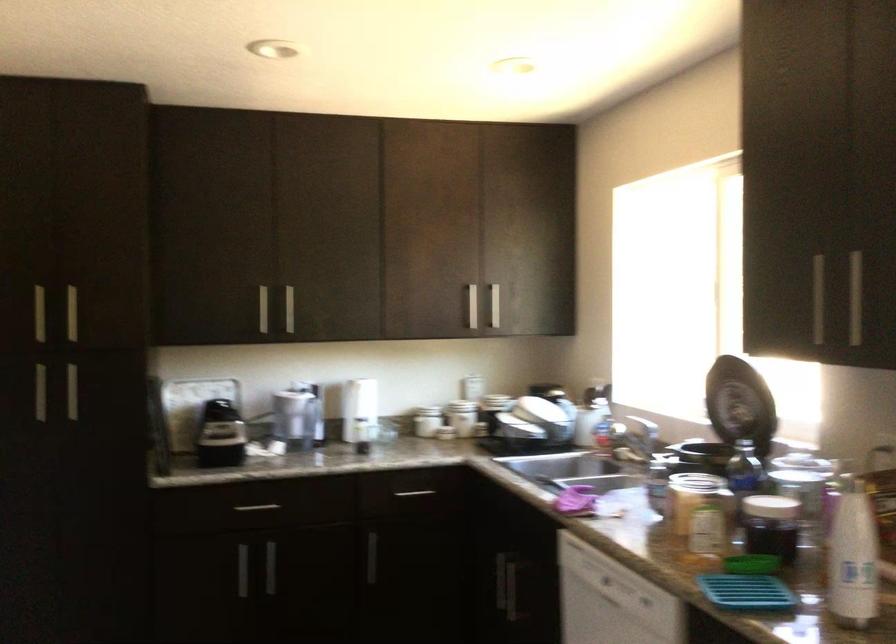
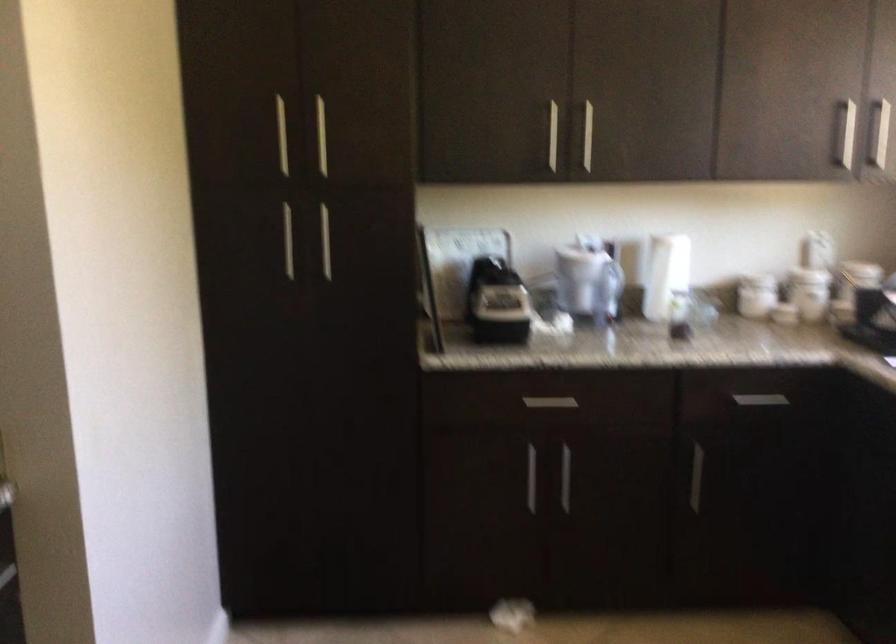
Question: Based on the continuous images, in which direction is the camera rotating? Reply with the corresponding letter.

Choices:
 (A) Left
 (B) Right
 (C) Up
 (D) Down

Answer: (A)